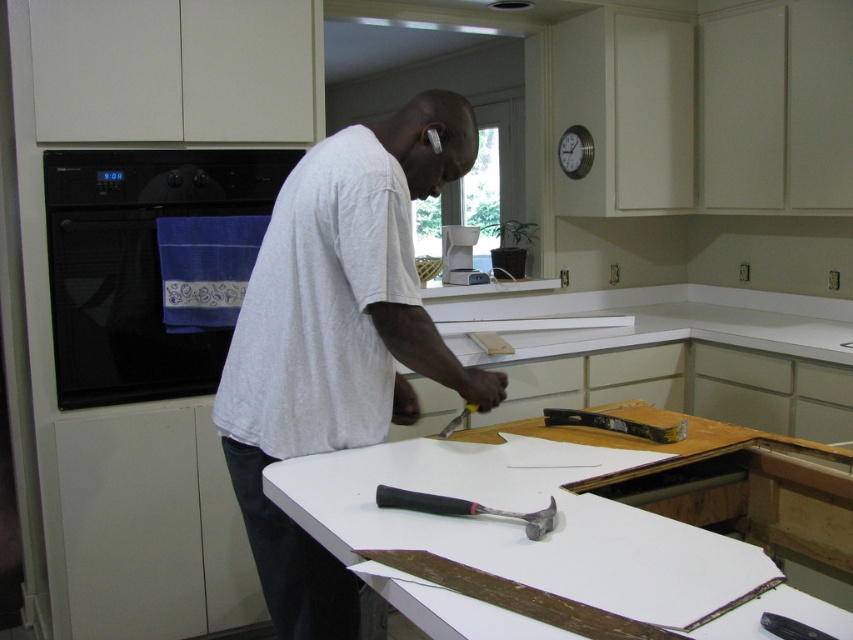
You are a home inspector examining the kitchen. You notice the white matte shirt at center and the black rubber hammer at center. Which object is closer to you?

The white matte shirt at center is closer to you because the black rubber hammer at center is behind it.

You are a kitchen designer planning to install a new coffee maker. You see the black rubber hammer at center and the white plastic coffee maker at center. Which object is located below the other?

The black rubber hammer at center is positioned under the white plastic coffee maker at center, so the hammer is below the coffee maker.